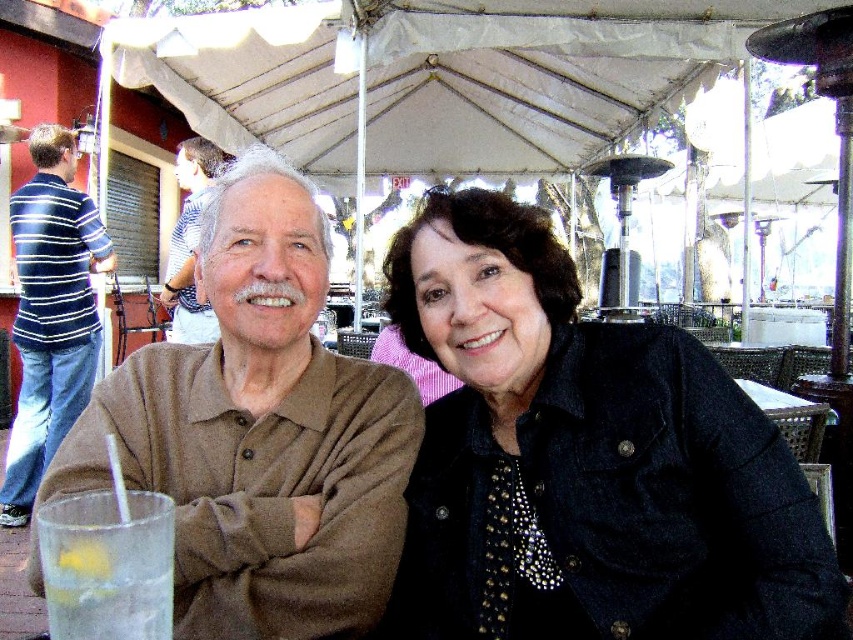
Describe the element at coordinates (584, 460) in the screenshot. I see `black denim jacket at center` at that location.

Does point (827, 616) lie in front of point (386, 522)?

Yes.

Where is `black denim jacket at center`? black denim jacket at center is located at coordinates (584, 460).

Does point (461, 540) lie in front of point (173, 273)?

Yes, point (461, 540) is in front of point (173, 273).

Can you confirm if black denim jacket at center is positioned to the left of striped cotton shirt at upper left?

Incorrect, black denim jacket at center is not on the left side of striped cotton shirt at upper left.

Does point (514, 268) come in front of point (189, 189)?

Yes.

I want to click on black denim jacket at center, so click(x=584, y=460).

Can you confirm if clear glass at lower left is taller than striped cotton shirt at upper left?

No.

Is clear glass at lower left thinner than striped cotton shirt at upper left?

Yes.

Does point (57, 554) lie behind point (196, 340)?

No, (57, 554) is closer to viewer.

The width and height of the screenshot is (853, 640). In order to click on clear glass at lower left in this screenshot , I will do `click(107, 564)`.